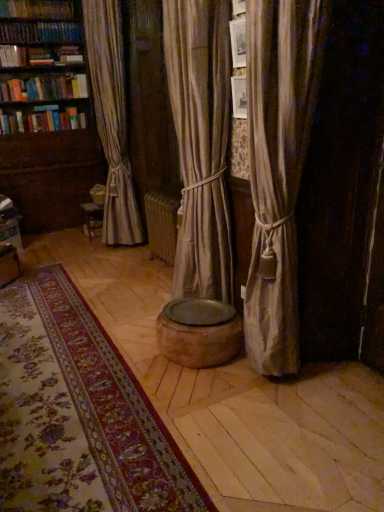
At what (x,y) coordinates should I click in order to perform the action: click on vacant area that is situated to the right of silky beige curtain at right. Please return your answer as a coordinate pair (x, y). This screenshot has height=512, width=384. Looking at the image, I should click on (349, 374).